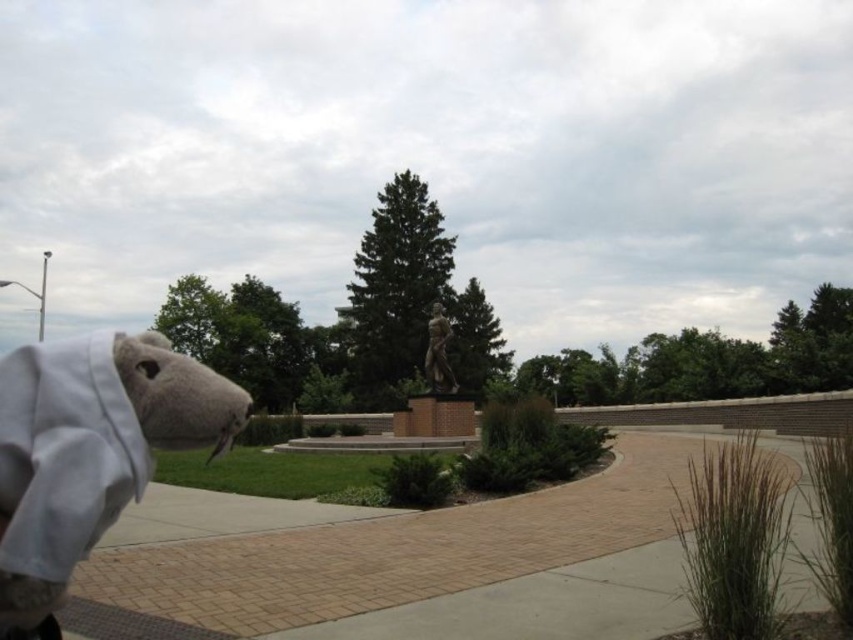
You are a visitor at the park and see the white plush toy at left and the bronze statue at center. Which object is nearer to you?

The white plush toy at left is closer to the viewer than the bronze statue at center.

You are standing at the statue and want to walk towards the point labeled as point (437, 324). However, there is an obstacle located at point (451, 632). Will you encounter this obstacle before reaching your destination?

Yes, you will encounter the obstacle at point (451, 632) before reaching point (437, 324) because point (451, 632) is in front of point (437, 324) from your current position at the statue.

From the picture: You are a visitor at the park and see the brick pavement at center and the white plush toy at left. Which object is positioned higher in the image?

The white plush toy at left is positioned higher than the brick pavement at center, as the brick pavement at center is located below it.